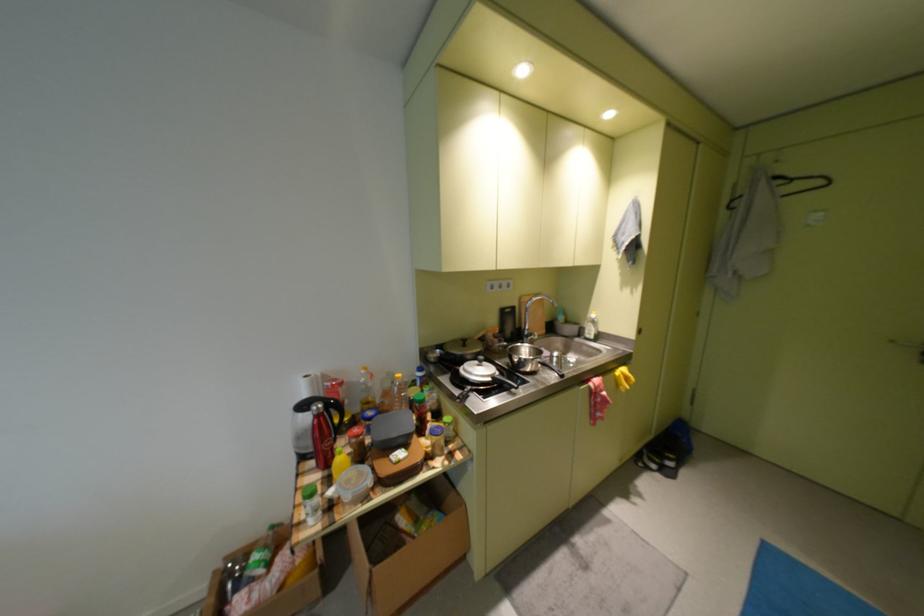
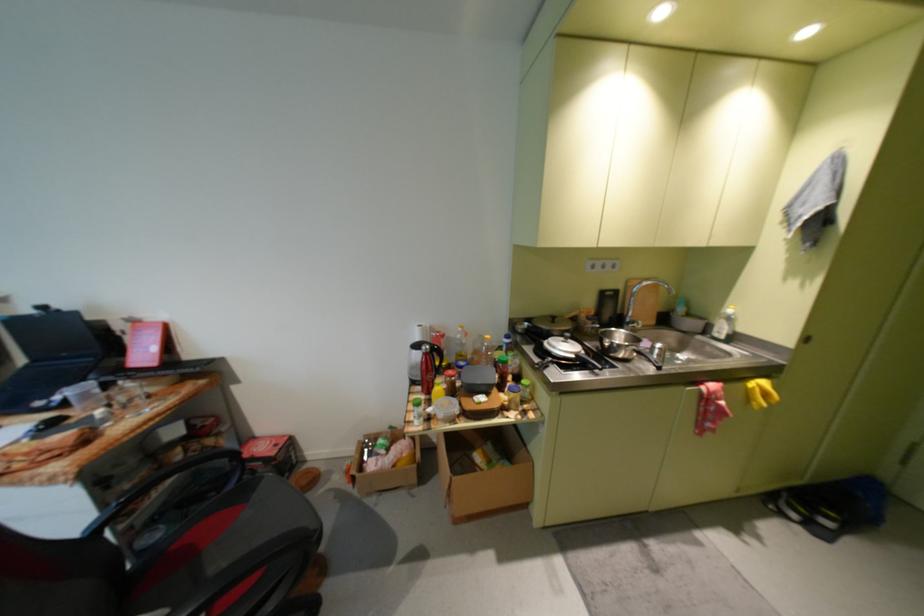
Where in the second image is the point corresponding to point 541,301 from the first image?

(650, 285)